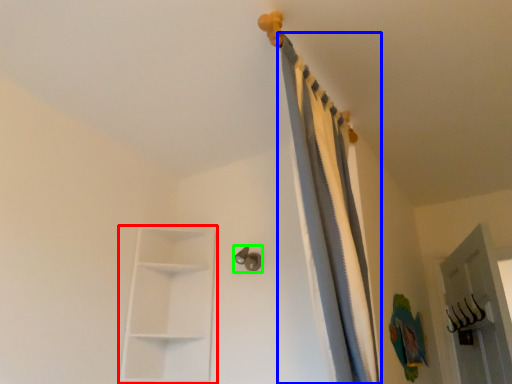
Question: Which object is positioned farthest from shelf (highlighted by a red box)? Select from curtain (highlighted by a blue box) and door handle (highlighted by a green box).

Choices:
 (A) curtain
 (B) door handle

Answer: (A)